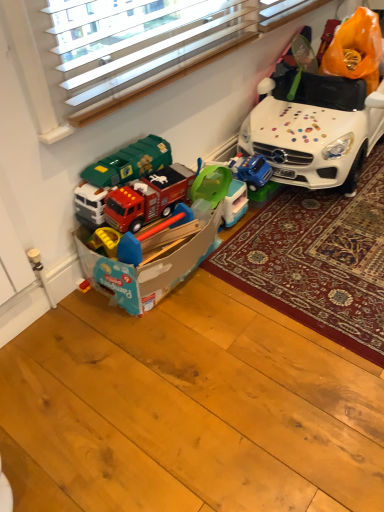
Locate an element on the screen. This screenshot has height=512, width=384. white carpet at center is located at coordinates (318, 260).

Describe the element at coordinates (155, 252) in the screenshot. I see `matte plastic toy box at lower left, marked as the 1th toy in a front-to-back arrangement` at that location.

In order to face white glossy toy car at upper right, should I rotate leftwards or rightwards?

Turn right approximately 18.390 degrees to face it.

Where is `white carpet at center`? This screenshot has width=384, height=512. white carpet at center is located at coordinates (318, 260).

This screenshot has width=384, height=512. I want to click on toy located in front of the green plastic toy at center, acting as the second toy starting from the front, so click(155, 252).

Considering the relative sizes of matte plastic toy box at lower left, marked as the 1th toy in a front-to-back arrangement, and green plastic toy at center, acting as the second toy starting from the front, in the image provided, is matte plastic toy box at lower left, marked as the 1th toy in a front-to-back arrangement, taller than green plastic toy at center, acting as the second toy starting from the front,?

Yes.

Considering the positions of point (126, 236) and point (226, 183), is point (126, 236) closer or farther from the camera than point (226, 183)?

Point (126, 236) is positioned closer to the camera compared to point (226, 183).

In the image, is matte plastic toy box at lower left, marked as the 1th toy in a front-to-back arrangement, positioned in front of or behind green plastic toy at center, arranged as the 1th toy when viewed from the back?

matte plastic toy box at lower left, marked as the 1th toy in a front-to-back arrangement, is positioned closer to the viewer than green plastic toy at center, arranged as the 1th toy when viewed from the back.

Which object is positioned more to the left, matte plastic toy box at lower left, marked as the 1th toy in a front-to-back arrangement, or white carpet at center?

matte plastic toy box at lower left, marked as the 1th toy in a front-to-back arrangement, is more to the left.

Which object is further away from the camera taking this photo, matte plastic toy box at lower left, placed as the second toy when sorted from back to front, or white carpet at center?

white carpet at center is further from the camera.

Does matte plastic toy box at lower left, marked as the 1th toy in a front-to-back arrangement, touch white carpet at center?

matte plastic toy box at lower left, marked as the 1th toy in a front-to-back arrangement, and white carpet at center are clearly separated.

The height and width of the screenshot is (512, 384). Identify the location of mat located on the right of matte plastic toy box at lower left, marked as the 1th toy in a front-to-back arrangement. (318, 260).

How distant is green plastic toy at center, arranged as the 1th toy when viewed from the back, from matte plastic toy box at lower left, marked as the 1th toy in a front-to-back arrangement?

7.79 inches.

Between green plastic toy at center, arranged as the 1th toy when viewed from the back, and matte plastic toy box at lower left, marked as the 1th toy in a front-to-back arrangement, which one has smaller size?

Smaller between the two is green plastic toy at center, arranged as the 1th toy when viewed from the back.

Is green plastic toy at center, acting as the second toy starting from the front, in front of or behind matte plastic toy box at lower left, marked as the 1th toy in a front-to-back arrangement, in the image?

green plastic toy at center, acting as the second toy starting from the front, is behind matte plastic toy box at lower left, marked as the 1th toy in a front-to-back arrangement.

Is green plastic toy at center, acting as the second toy starting from the front, aimed at matte plastic toy box at lower left, marked as the 1th toy in a front-to-back arrangement?

No, green plastic toy at center, acting as the second toy starting from the front, is not facing towards matte plastic toy box at lower left, marked as the 1th toy in a front-to-back arrangement.

Where is `the 2nd toy to the left of the white glossy toy car at upper right, starting your count from the anchor`? The width and height of the screenshot is (384, 512). the 2nd toy to the left of the white glossy toy car at upper right, starting your count from the anchor is located at coordinates (155, 252).

Does white glossy toy car at upper right have a greater width compared to matte plastic toy box at lower left, placed as the second toy when sorted from back to front?

Correct, the width of white glossy toy car at upper right exceeds that of matte plastic toy box at lower left, placed as the second toy when sorted from back to front.

From a real-world perspective, between white glossy toy car at upper right and matte plastic toy box at lower left, marked as the 1th toy in a front-to-back arrangement, who is vertically lower?

matte plastic toy box at lower left, marked as the 1th toy in a front-to-back arrangement, from a real-world perspective.

In terms of size, does white glossy toy car at upper right appear bigger or smaller than matte plastic toy box at lower left, placed as the second toy when sorted from back to front?

Considering their sizes, white glossy toy car at upper right takes up more space than matte plastic toy box at lower left, placed as the second toy when sorted from back to front.

Is matte plastic toy box at lower left, placed as the second toy when sorted from back to front, oriented towards white glossy toy car at upper right?

No, matte plastic toy box at lower left, placed as the second toy when sorted from back to front, is not turned towards white glossy toy car at upper right.

The height and width of the screenshot is (512, 384). I want to click on car above the matte plastic toy box at lower left, marked as the 1th toy in a front-to-back arrangement (from a real-world perspective), so click(x=314, y=129).

Based on their positions, is matte plastic toy box at lower left, marked as the 1th toy in a front-to-back arrangement, located to the left or right of white glossy toy car at upper right?

Clearly, matte plastic toy box at lower left, marked as the 1th toy in a front-to-back arrangement, is on the left of white glossy toy car at upper right in the image.

Which object is further away from the camera taking this photo, matte plastic toy box at lower left, marked as the 1th toy in a front-to-back arrangement, or white glossy toy car at upper right?

white glossy toy car at upper right.

Between point (373, 296) and point (168, 253), which one is positioned in front?

The point (168, 253) is in front.

I want to click on mat behind the matte plastic toy box at lower left, placed as the second toy when sorted from back to front, so click(x=318, y=260).

Can you tell me how much white carpet at center and matte plastic toy box at lower left, placed as the second toy when sorted from back to front, differ in facing direction?

The angular difference between white carpet at center and matte plastic toy box at lower left, placed as the second toy when sorted from back to front, is 2.34 degrees.

Does white carpet at center have a lesser width compared to matte plastic toy box at lower left, marked as the 1th toy in a front-to-back arrangement?

No, white carpet at center is not thinner than matte plastic toy box at lower left, marked as the 1th toy in a front-to-back arrangement.

Is white carpet at center further to camera compared to white glossy toy car at upper right?

That is False.

Is white carpet at center wider or thinner than white glossy toy car at upper right?

Considering their sizes, white carpet at center looks broader than white glossy toy car at upper right.

Considering the relative sizes of white carpet at center and white glossy toy car at upper right in the image provided, is white carpet at center shorter than white glossy toy car at upper right?

Correct, white carpet at center is not as tall as white glossy toy car at upper right.

From the image's perspective, is white carpet at center positioned above or below white glossy toy car at upper right?

Based on their image positions, white carpet at center is located beneath white glossy toy car at upper right.

The height and width of the screenshot is (512, 384). I want to click on toy that is above the green plastic toy at center, arranged as the 1th toy when viewed from the back (from a real-world perspective), so click(x=155, y=252).

You are a GUI agent. You are given a task and a screenshot of the screen. Output one action in this format:
    pyautogui.click(x=<x>, y=<y>)
    Task: Click on the mat located underneath the matte plastic toy box at lower left, placed as the second toy when sorted from back to front (from a real-world perspective)
    This screenshot has height=512, width=384.
    Given the screenshot: What is the action you would take?
    pyautogui.click(x=318, y=260)

Estimate the real-world distances between objects in this image. Which object is further from white glossy toy car at upper right, matte plastic toy box at lower left, marked as the 1th toy in a front-to-back arrangement, or white carpet at center?

Among the two, matte plastic toy box at lower left, marked as the 1th toy in a front-to-back arrangement, is located further to white glossy toy car at upper right.

Looking at the image, which one is located further to white glossy toy car at upper right, white carpet at center or matte plastic toy box at lower left, placed as the second toy when sorted from back to front?

matte plastic toy box at lower left, placed as the second toy when sorted from back to front.

From the image, which object appears to be farther from green plastic toy at center, acting as the second toy starting from the front, matte plastic toy box at lower left, placed as the second toy when sorted from back to front, or white carpet at center?

Based on the image, white carpet at center appears to be further to green plastic toy at center, acting as the second toy starting from the front.

Considering their positions, is green plastic toy at center, arranged as the 1th toy when viewed from the back, positioned further to white carpet at center than matte plastic toy box at lower left, placed as the second toy when sorted from back to front?

Based on the image, matte plastic toy box at lower left, placed as the second toy when sorted from back to front, appears to be further to white carpet at center.

From the image, which object appears to be farther from white carpet at center, matte plastic toy box at lower left, marked as the 1th toy in a front-to-back arrangement, or white glossy toy car at upper right?

matte plastic toy box at lower left, marked as the 1th toy in a front-to-back arrangement, is further to white carpet at center.

Estimate the real-world distances between objects in this image. Which object is closer to matte plastic toy box at lower left, marked as the 1th toy in a front-to-back arrangement, white glossy toy car at upper right or white carpet at center?

white carpet at center.

Which object lies further to the anchor point matte plastic toy box at lower left, placed as the second toy when sorted from back to front, green plastic toy at center, arranged as the 1th toy when viewed from the back, or white glossy toy car at upper right?

white glossy toy car at upper right is positioned further to the anchor matte plastic toy box at lower left, placed as the second toy when sorted from back to front.

Estimate the real-world distances between objects in this image. Which object is closer to white glossy toy car at upper right, matte plastic toy box at lower left, marked as the 1th toy in a front-to-back arrangement, or green plastic toy at center, acting as the second toy starting from the front?

Among the two, green plastic toy at center, acting as the second toy starting from the front, is located nearer to white glossy toy car at upper right.

Locate an element on the screen. This screenshot has width=384, height=512. car between matte plastic toy box at lower left, placed as the second toy when sorted from back to front, and white carpet at center is located at coordinates (314, 129).

Where is `toy between matte plastic toy box at lower left, marked as the 1th toy in a front-to-back arrangement, and white carpet at center from left to right`? toy between matte plastic toy box at lower left, marked as the 1th toy in a front-to-back arrangement, and white carpet at center from left to right is located at coordinates (222, 192).

The height and width of the screenshot is (512, 384). I want to click on toy located between matte plastic toy box at lower left, placed as the second toy when sorted from back to front, and white glossy toy car at upper right in the left-right direction, so click(222, 192).

The image size is (384, 512). Find the location of `car situated between green plastic toy at center, arranged as the 1th toy when viewed from the back, and white carpet at center from left to right`. car situated between green plastic toy at center, arranged as the 1th toy when viewed from the back, and white carpet at center from left to right is located at coordinates (314, 129).